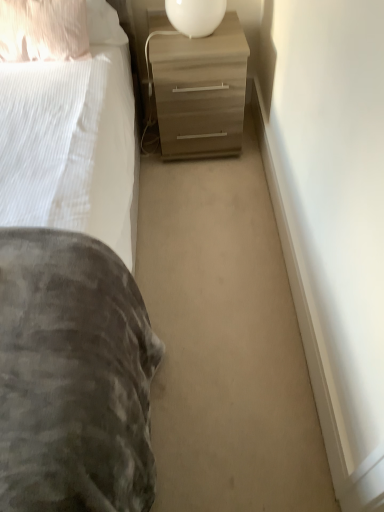
Question: Should I look upward or downward to see pillow at upper left?

Choices:
 (A) up
 (B) down

Answer: (A)

Question: Does pillow at upper left appear on the left side of matte wood chest of drawers at center?

Choices:
 (A) yes
 (B) no

Answer: (A)

Question: Is pillow at upper left at the right side of matte wood chest of drawers at center?

Choices:
 (A) no
 (B) yes

Answer: (A)

Question: From the image's perspective, does pillow at upper left appear lower than matte wood chest of drawers at center?

Choices:
 (A) yes
 (B) no

Answer: (B)

Question: Is pillow at upper left in contact with matte wood chest of drawers at center?

Choices:
 (A) no
 (B) yes

Answer: (A)

Question: Is pillow at upper left facing away from matte wood chest of drawers at center?

Choices:
 (A) yes
 (B) no

Answer: (B)

Question: Is pillow at upper left closer to the viewer compared to matte wood chest of drawers at center?

Choices:
 (A) yes
 (B) no

Answer: (A)

Question: Is matte wood chest of drawers at center in contact with white glossy table lamp at upper center?

Choices:
 (A) no
 (B) yes

Answer: (A)

Question: Could you tell me if matte wood chest of drawers at center is turned towards white glossy table lamp at upper center?

Choices:
 (A) no
 (B) yes

Answer: (A)

Question: From a real-world perspective, is matte wood chest of drawers at center located higher than white glossy table lamp at upper center?

Choices:
 (A) no
 (B) yes

Answer: (A)

Question: Is matte wood chest of drawers at center wider than white glossy table lamp at upper center?

Choices:
 (A) yes
 (B) no

Answer: (A)

Question: Does matte wood chest of drawers at center come behind white glossy table lamp at upper center?

Choices:
 (A) yes
 (B) no

Answer: (A)

Question: Is matte wood chest of drawers at center not inside white glossy table lamp at upper center?

Choices:
 (A) no
 (B) yes

Answer: (B)

Question: Is white glossy table lamp at upper center smaller than matte wood chest of drawers at center?

Choices:
 (A) no
 (B) yes

Answer: (B)